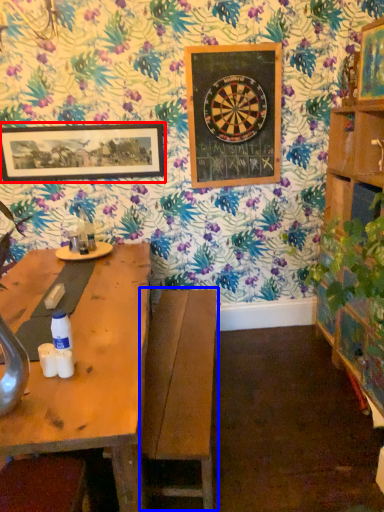
Question: Among these objects, which one is nearest to the camera, picture frame (highlighted by a red box) or swivel chair (highlighted by a blue box)?

Choices:
 (A) picture frame
 (B) swivel chair

Answer: (B)